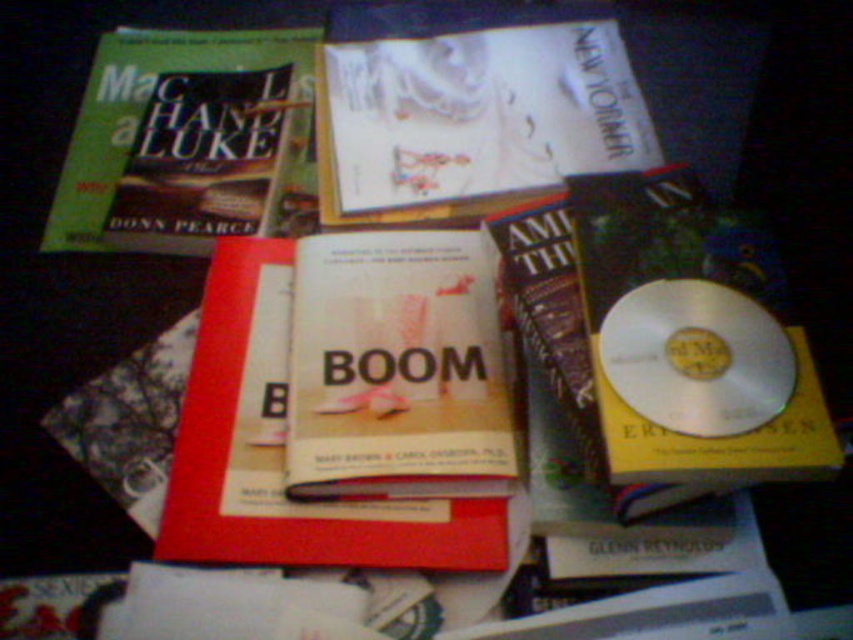
Can you confirm if white paper magazine at upper center is shorter than hardcover book at center?

No.

Which is in front, point (612, 76) or point (294, 508)?

Point (294, 508)

You are a GUI agent. You are given a task and a screenshot of the screen. Output one action in this format:
    pyautogui.click(x=<x>, y=<y>)
    Task: Click on the white paper magazine at upper center
    This screenshot has height=640, width=853.
    Given the screenshot: What is the action you would take?
    point(469,108)

Who is taller, silver metallic cd at right or white paper magazine at upper center?

With more height is white paper magazine at upper center.

Is silver metallic cd at right to the left of white paper magazine at upper center from the viewer's perspective?

In fact, silver metallic cd at right is to the right of white paper magazine at upper center.

Which is in front, point (746, 468) or point (534, 124)?

Positioned in front is point (746, 468).

Find the location of a particular element. silver metallic cd at right is located at coordinates (693, 337).

At what (x,y) coordinates should I click in order to perform the action: click on white paper magazine at upper center. Please return your answer as a coordinate pair (x, y). The width and height of the screenshot is (853, 640). Looking at the image, I should click on (469, 108).

Consider the image. Measure the distance between point (399, 56) and camera.

A distance of 36.23 inches exists between point (399, 56) and camera.

Identify the location of white paper magazine at upper center. (469, 108).